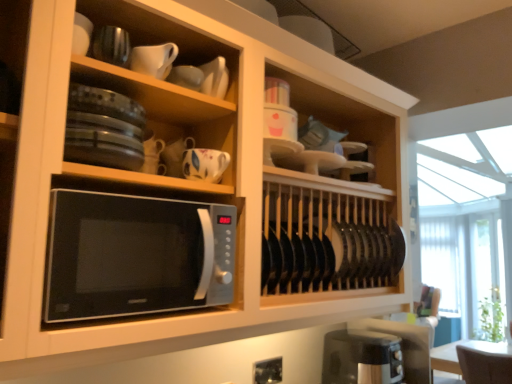
Locate an element on the screen. The height and width of the screenshot is (384, 512). vacant area on top of black plastic toaster at lower right (from a real-world perspective) is located at coordinates (374, 330).